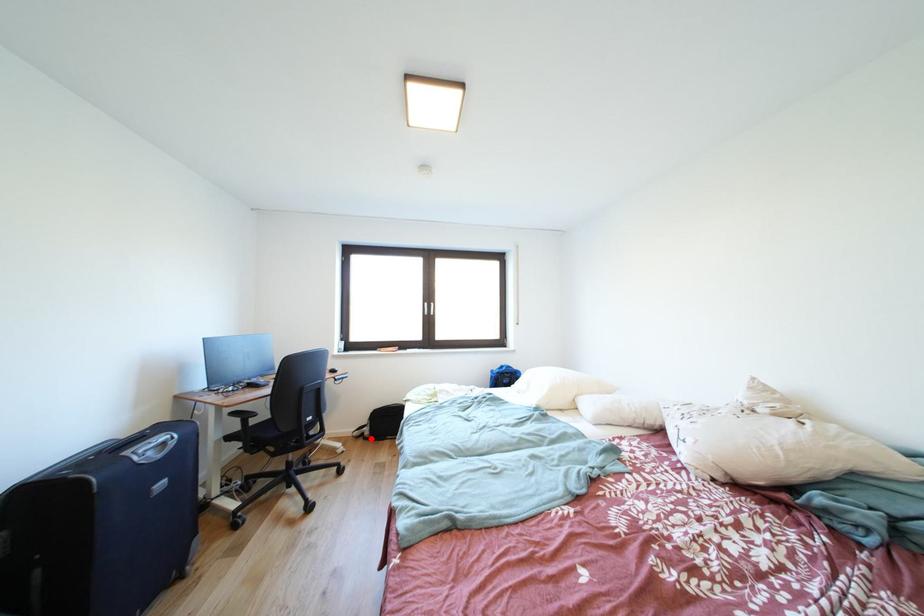
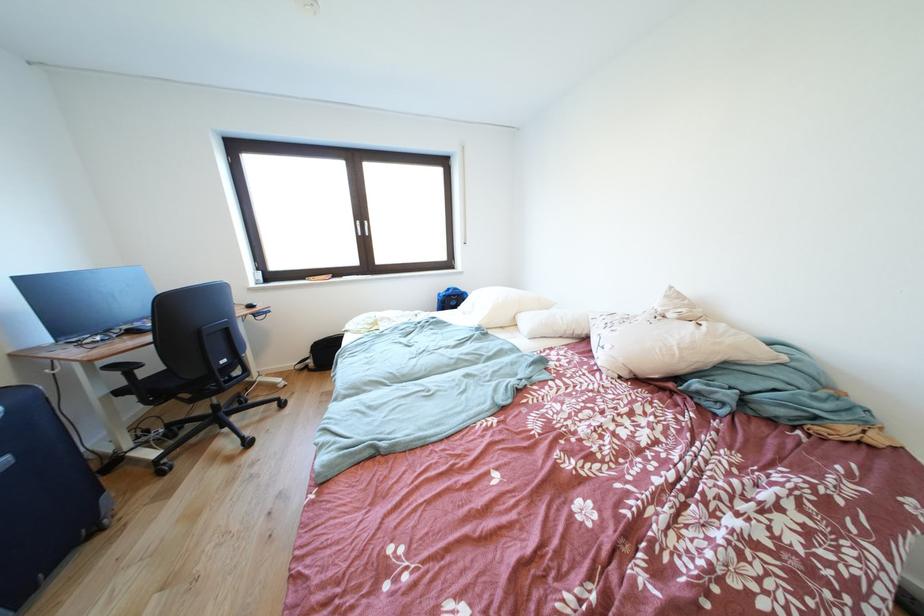
The point at the highlighted location is marked in the first image. Where is the corresponding point in the second image?

(315, 371)